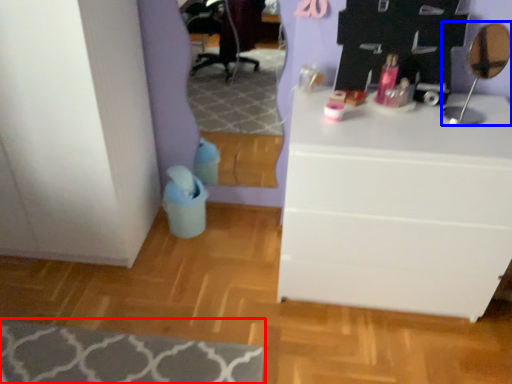
Question: Among these objects, which one is nearest to the camera, mat (highlighted by a red box) or mirror (highlighted by a blue box)?

Choices:
 (A) mat
 (B) mirror

Answer: (B)